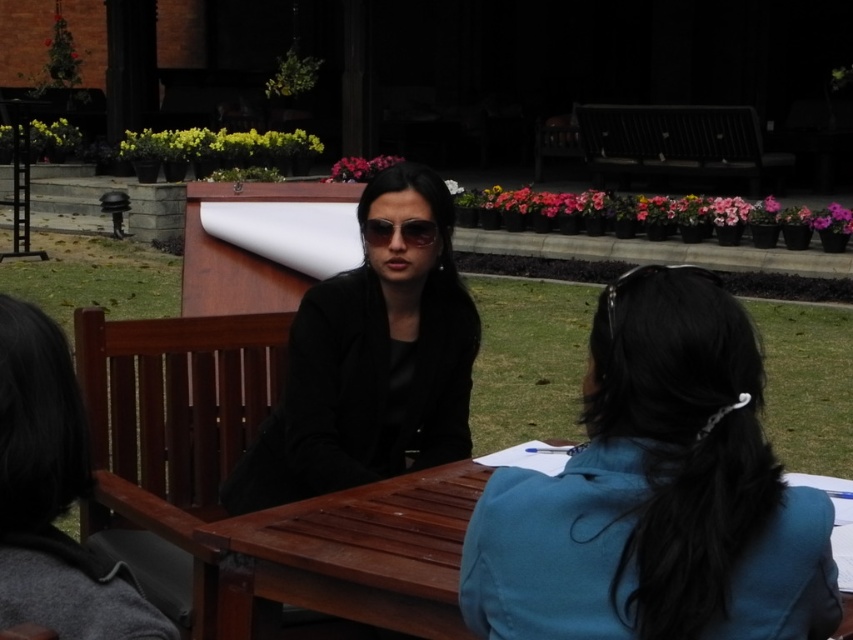
Between dark wood park bench at upper center and clear plastic goggles at center, which one appears on the left side from the viewer's perspective?

Positioned to the left is clear plastic goggles at center.

Can you confirm if dark wood park bench at upper center is taller than clear plastic goggles at center?

Correct, dark wood park bench at upper center is much taller as clear plastic goggles at center.

The height and width of the screenshot is (640, 853). What are the coordinates of `dark wood park bench at upper center` in the screenshot? It's located at (676, 141).

Consider the image. Measure the distance between wooden table at center and camera.

The distance of wooden table at center from camera is 1.86 meters.

Describe the element at coordinates (357, 556) in the screenshot. I see `wooden table at center` at that location.

The width and height of the screenshot is (853, 640). Identify the location of wooden table at center. (357, 556).

Looking at this image, how distant is blue fabric at center from wooden table at center?

22.62 inches

I want to click on blue fabric at center, so click(x=656, y=492).